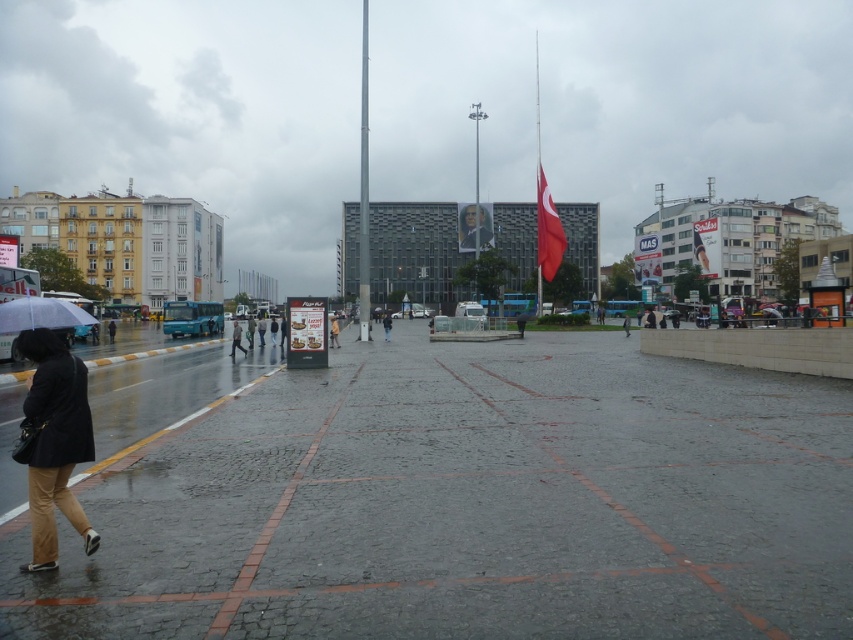
You are a fashion designer observing the urban square scene. You notice two jackets in the crowd. The yellow fabric jacket at center and the black matte jacket at lower left. Which jacket appears to be narrower?

The yellow fabric jacket at center has a lesser width compared to the black matte jacket at lower left, so it appears narrower.

You are standing in the urban square and want to walk from the gray cobblestone pavement at center to the matte black coat at lower left. Which direction should you head?

The gray cobblestone pavement at center is in front of the matte black coat at lower left, so you should walk backward to reach the matte black coat at lower left.